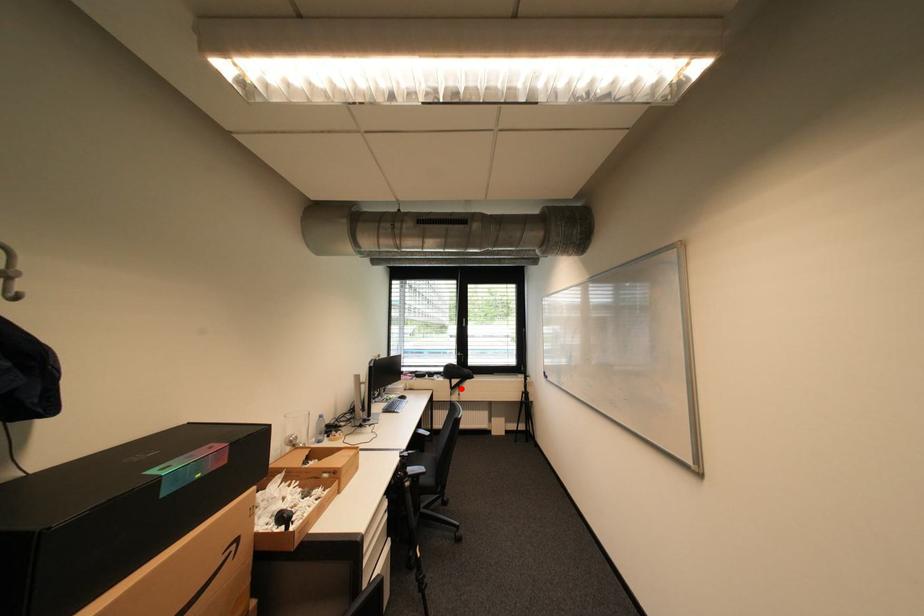
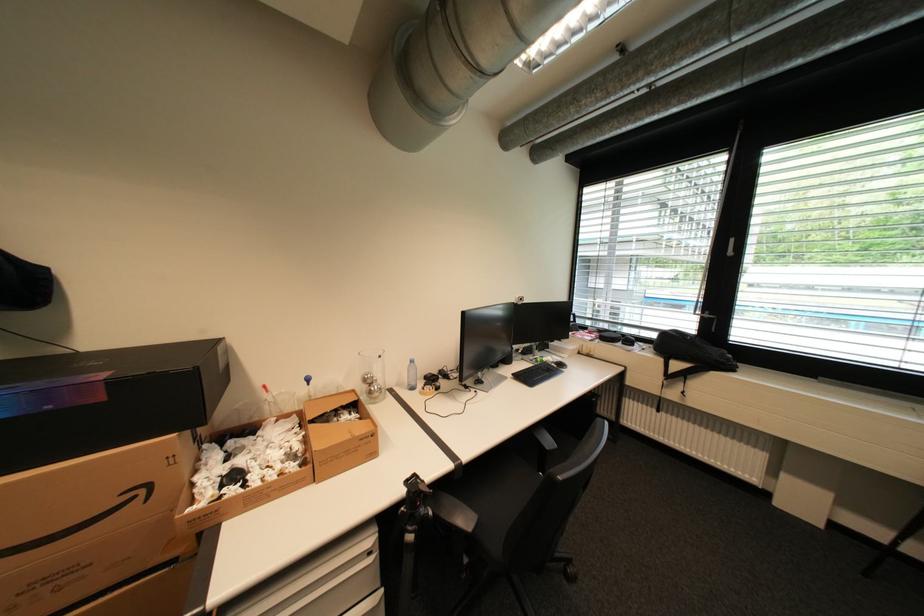
The point at the highlighted location is marked in the first image. Where is the corresponding point in the second image?

(678, 377)